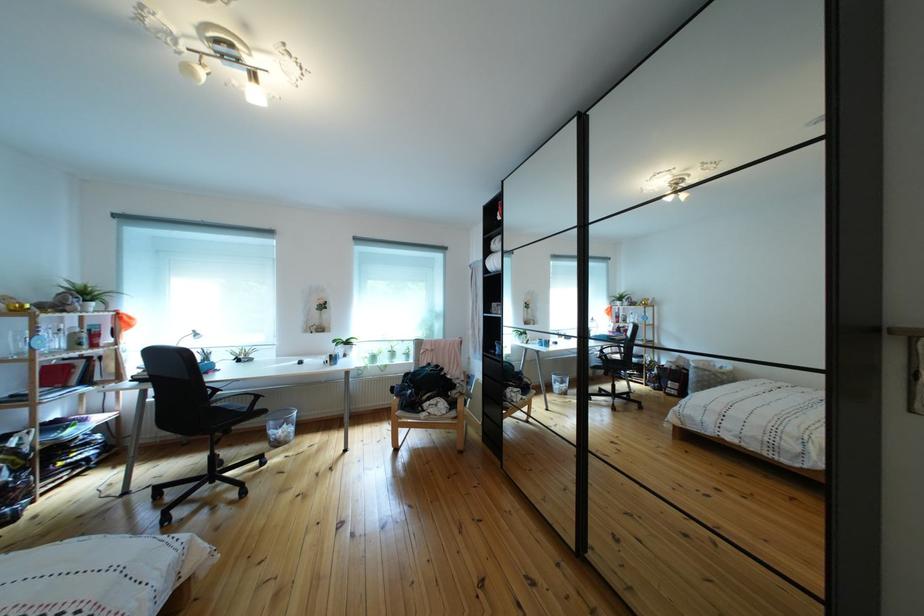
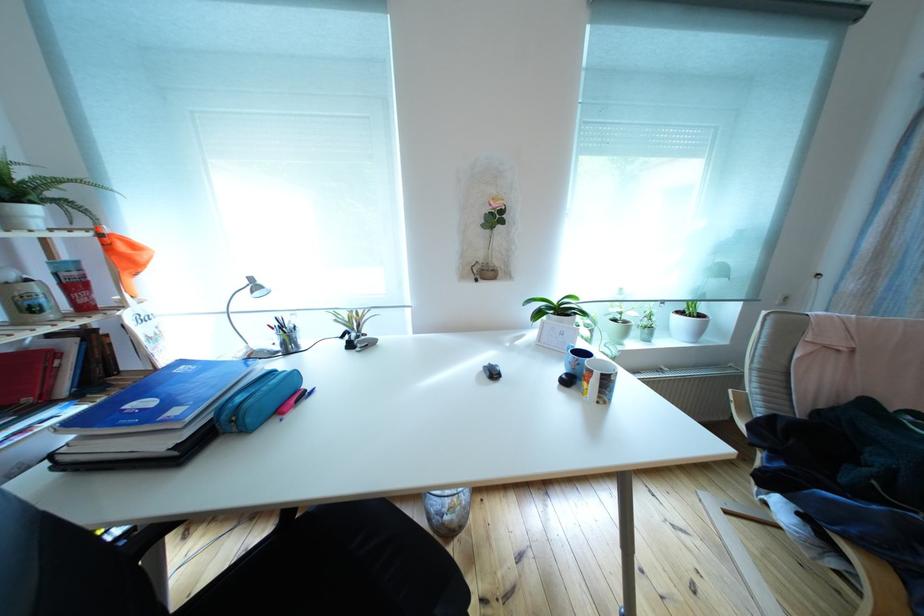
The images are taken continuously from a first-person perspective. In which direction are you moving?

The movement direction of the cameraman is left, forward.